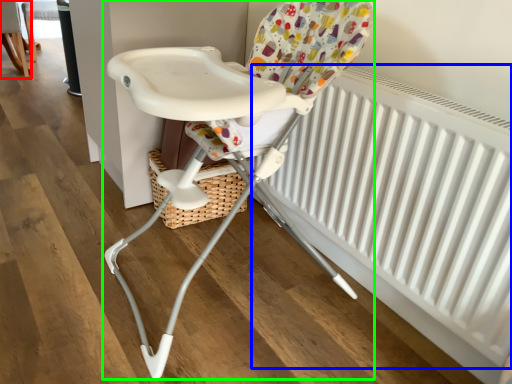
Question: Estimate the real-world distances between objects in this image. Which object is farther from chair (highlighted by a red box), radiator (highlighted by a blue box) or chair (highlighted by a green box)?

Choices:
 (A) radiator
 (B) chair

Answer: (A)